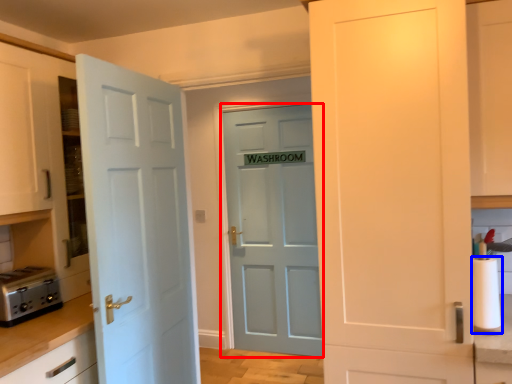
Question: Among these objects, which one is farthest to the camera, door (highlighted by a red box) or paper towel (highlighted by a blue box)?

Choices:
 (A) door
 (B) paper towel

Answer: (A)